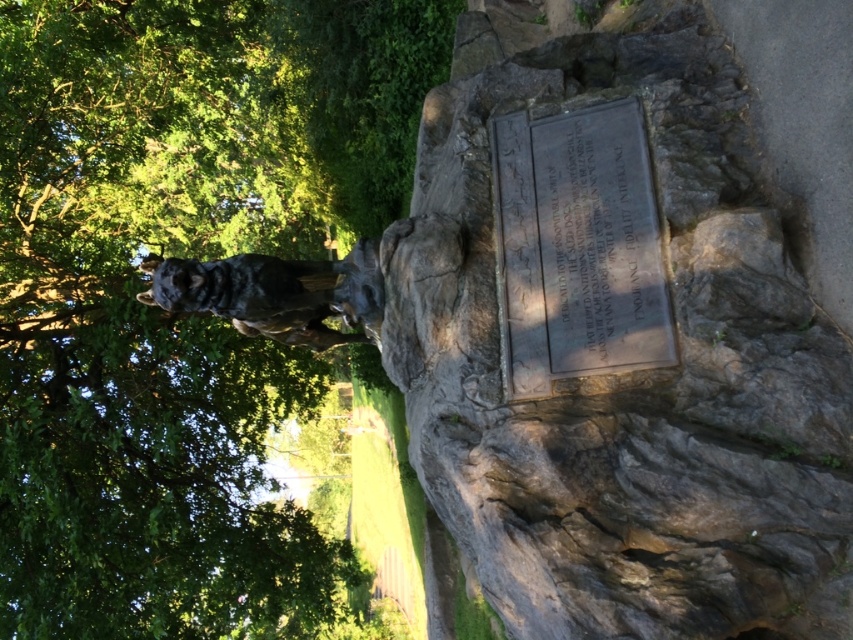
Between point (821, 540) and point (520, 160), which one is positioned in front?

Positioned in front is point (821, 540).

Is point (674, 588) farther from viewer compared to point (596, 228)?

No, (674, 588) is in front of (596, 228).

Is point (814, 54) in front of point (561, 349)?

Yes, it is in front of point (561, 349).

You are a GUI agent. You are given a task and a screenshot of the screen. Output one action in this format:
    pyautogui.click(x=<x>, y=<y>)
    Task: Click on the gray rough stone at center
    
    Given the screenshot: What is the action you would take?
    pyautogui.click(x=621, y=358)

Is green leafy tree at upper left wider than shiny bronze wolf at center?

Correct, the width of green leafy tree at upper left exceeds that of shiny bronze wolf at center.

Does green leafy tree at upper left come behind shiny bronze wolf at center?

Yes, it is behind shiny bronze wolf at center.

Identify the location of green leafy tree at upper left. [142, 330].

The image size is (853, 640). Identify the location of green leafy tree at upper left. (142, 330).

Where is `gray rough stone at center`? Image resolution: width=853 pixels, height=640 pixels. gray rough stone at center is located at coordinates (621, 358).

Locate an element on the screen. The width and height of the screenshot is (853, 640). gray rough stone at center is located at coordinates (621, 358).